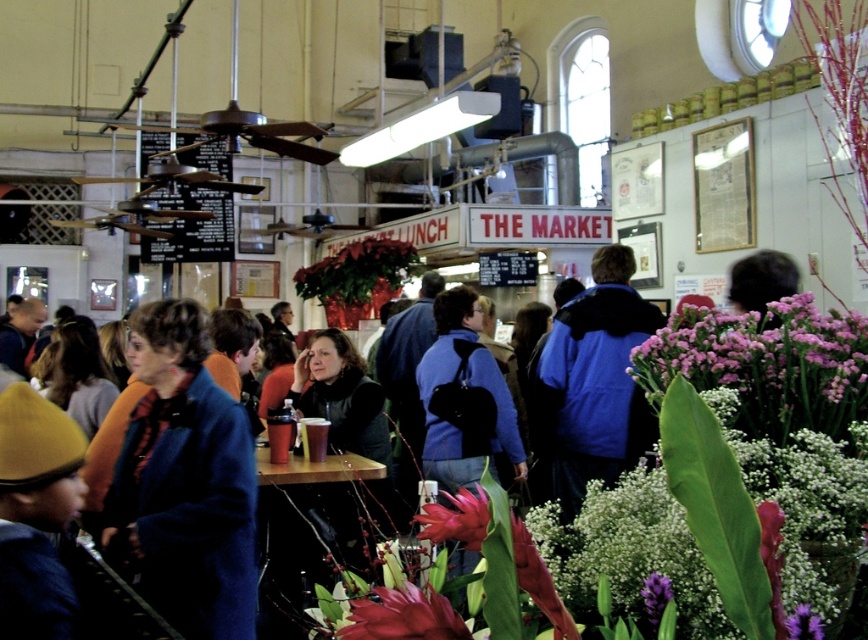
Question: Which point is farther to the camera?

Choices:
 (A) (608, 394)
 (B) (248, 493)
 (C) (783, 349)

Answer: (A)

Question: Is purple matte flowers at center further to the viewer compared to blue woolen coat at center?

Choices:
 (A) yes
 (B) no

Answer: (B)

Question: Can you confirm if blue fleece jacket at center is positioned to the right of vivid pink petal at center?

Choices:
 (A) yes
 (B) no

Answer: (A)

Question: Estimate the real-world distances between objects in this image. Which object is closer to the purple matte flowers at right?

Choices:
 (A) vivid pink petal at center
 (B) glossy red flower at center
 (C) blue fleece jacket at center

Answer: (A)

Question: Which of the following is the farthest from the observer?

Choices:
 (A) (788, 634)
 (B) (183, 536)

Answer: (B)

Question: Does purple matte flowers at right appear on the right side of blue fleece jacket at center?

Choices:
 (A) yes
 (B) no

Answer: (B)